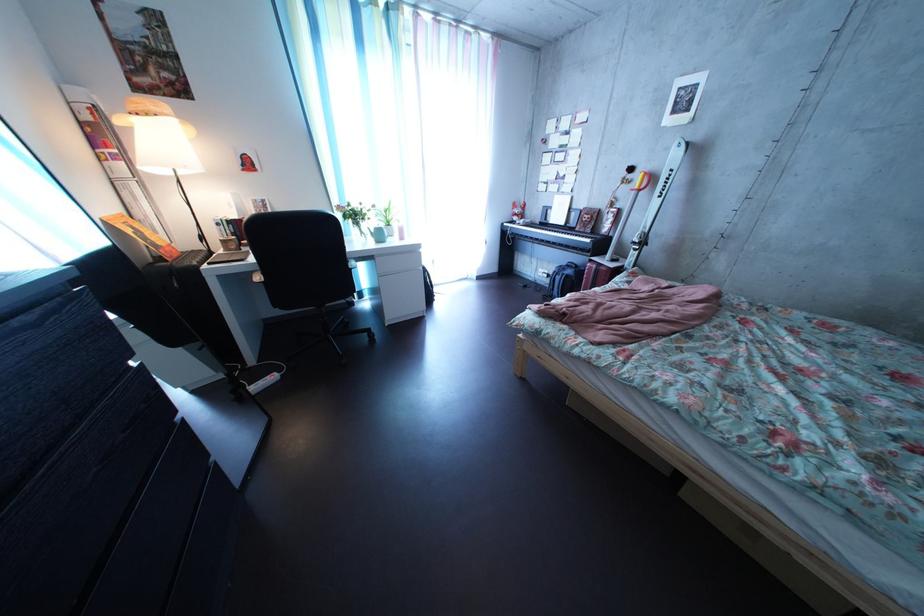
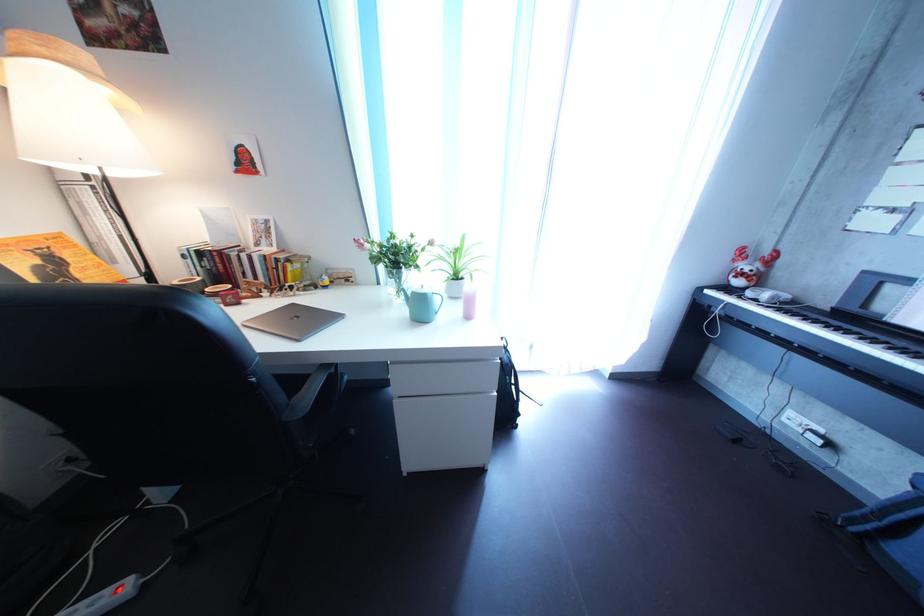
The point at (394,244) is marked in the first image. Where is the corresponding point in the second image?

(433, 315)